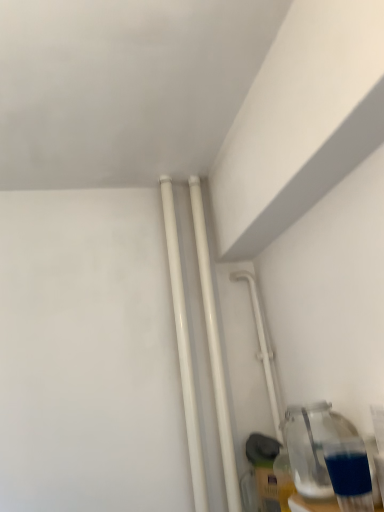
At what (x,y) coordinates should I click in order to perform the action: click on white glossy pipes at center, acting as the first pipe starting from the right. Please return your answer as a coordinate pair (x, y). Looking at the image, I should click on (214, 348).

What do you see at coordinates (214, 348) in the screenshot? I see `white glossy pipes at center, which is the 2th pipe in left-to-right order` at bounding box center [214, 348].

The height and width of the screenshot is (512, 384). I want to click on white glossy pipes at center, which is the second pipe from right to left, so coord(184,348).

The width and height of the screenshot is (384, 512). Describe the element at coordinates (310, 445) in the screenshot. I see `transparent glass bottle at lower right` at that location.

You are a GUI agent. You are given a task and a screenshot of the screen. Output one action in this format:
    pyautogui.click(x=<x>, y=<y>)
    Task: Click on the white glossy pipes at center, acting as the first pipe starting from the right
    
    Given the screenshot: What is the action you would take?
    pyautogui.click(x=214, y=348)

From a real-world perspective, which object stands above the other?

white glossy pipes at center, acting as the first pipe starting from the left, from a real-world perspective.

Is white glossy pipes at center, which is the second pipe from right to left, in contact with transparent glass bottle at lower right?

No.

Where is `bottle below the white glossy pipes at center, acting as the first pipe starting from the left (from a real-world perspective)`? Image resolution: width=384 pixels, height=512 pixels. bottle below the white glossy pipes at center, acting as the first pipe starting from the left (from a real-world perspective) is located at coordinates (310, 445).

Considering the positions of objects white glossy pipe at center-right and white glossy pipes at center, acting as the first pipe starting from the left, in the image provided, who is more to the right, white glossy pipe at center-right or white glossy pipes at center, acting as the first pipe starting from the left,?

white glossy pipe at center-right.

Based on the photo, from the image's perspective, is white glossy pipe at center-right over white glossy pipes at center, acting as the first pipe starting from the left?

Incorrect, from the image's perspective, white glossy pipe at center-right is lower than white glossy pipes at center, acting as the first pipe starting from the left.

How many degrees apart are the facing directions of white glossy pipe at center-right and white glossy pipes at center, acting as the first pipe starting from the left?

white glossy pipe at center-right and white glossy pipes at center, acting as the first pipe starting from the left, are facing 2.59 degrees away from each other.

Looking at the image, does white glossy pipe at center-right seem bigger or smaller compared to white glossy pipes at center, acting as the first pipe starting from the left?

white glossy pipe at center-right is bigger than white glossy pipes at center, acting as the first pipe starting from the left.

Considering the positions of points (303, 417) and (179, 253), is point (303, 417) closer to camera compared to point (179, 253)?

Yes, point (303, 417) is in front of point (179, 253).

Is transparent glass bottle at lower right positioned far away from white glossy pipes at center, acting as the first pipe starting from the left?

transparent glass bottle at lower right is actually quite close to white glossy pipes at center, acting as the first pipe starting from the left.

Is transparent glass bottle at lower right not inside white glossy pipes at center, which is the second pipe from right to left?

Yes, transparent glass bottle at lower right is outside of white glossy pipes at center, which is the second pipe from right to left.

From the image's perspective, starting from the transparent glass bottle at lower right, which pipe is the 2nd one above? Please provide its 2D coordinates.

[(184, 348)]

Looking at this image, is the position of transparent glass bottle at lower right less distant than that of white glossy pipe at center-right?

Yes, it is in front of white glossy pipe at center-right.

Does transparent glass bottle at lower right have a smaller size compared to white glossy pipe at center-right?

No.

In the scene shown: Between transparent glass bottle at lower right and white glossy pipe at center-right, which one has smaller width?

white glossy pipe at center-right.

Which is closer to the camera, (345, 430) or (275, 397)?

Point (345, 430) appears to be closer to the viewer than point (275, 397).

Who is smaller, white glossy pipes at center, acting as the first pipe starting from the right, or white glossy pipe at center-right?

Smaller between the two is white glossy pipes at center, acting as the first pipe starting from the right.

Which object is closer to the camera taking this photo, white glossy pipes at center, acting as the first pipe starting from the right, or white glossy pipe at center-right?

white glossy pipes at center, acting as the first pipe starting from the right, is more forward.

Between point (211, 308) and point (279, 416), which one is positioned behind?

The point (211, 308) is farther from the camera.

Can white glossy pipe at center-right be found inside white glossy pipes at center, which is the 2th pipe in left-to-right order?

Actually, white glossy pipe at center-right is outside white glossy pipes at center, which is the 2th pipe in left-to-right order.

Would you say transparent glass bottle at lower right is part of white glossy pipes at center, which is the 2th pipe in left-to-right order,'s contents?

No, transparent glass bottle at lower right is not inside white glossy pipes at center, which is the 2th pipe in left-to-right order.

In terms of width, does white glossy pipes at center, which is the 2th pipe in left-to-right order, look wider or thinner when compared to transparent glass bottle at lower right?

Considering their sizes, white glossy pipes at center, which is the 2th pipe in left-to-right order, looks slimmer than transparent glass bottle at lower right.

Which object is positioned more to the right, white glossy pipes at center, acting as the first pipe starting from the right, or transparent glass bottle at lower right?

Positioned to the right is transparent glass bottle at lower right.

From the image's perspective, which one is positioned higher, white glossy pipes at center, acting as the first pipe starting from the right, or transparent glass bottle at lower right?

white glossy pipes at center, acting as the first pipe starting from the right, appears higher in the image.

At what (x,y) coordinates should I click in order to perform the action: click on pipe that appears above the white glossy pipes at center, which is the 2th pipe in left-to-right order (from a real-world perspective). Please return your answer as a coordinate pair (x, y). This screenshot has height=512, width=384. Looking at the image, I should click on (184, 348).

Visually, is white glossy pipes at center, acting as the first pipe starting from the left, positioned to the left or to the right of white glossy pipes at center, which is the 2th pipe in left-to-right order?

Clearly, white glossy pipes at center, acting as the first pipe starting from the left, is on the left of white glossy pipes at center, which is the 2th pipe in left-to-right order, in the image.

Consider the image. Can you see white glossy pipes at center, which is the second pipe from right to left, touching white glossy pipes at center, acting as the first pipe starting from the right?

Yes, white glossy pipes at center, which is the second pipe from right to left, is in contact with white glossy pipes at center, acting as the first pipe starting from the right.

Which is less distant, (187, 375) or (229, 458)?

The point (229, 458) is closer to the camera.

I want to click on the 2nd pipe to the left of the transparent glass bottle at lower right, counting from the anchor's position, so click(184, 348).

You are a GUI agent. You are given a task and a screenshot of the screen. Output one action in this format:
    pyautogui.click(x=<x>, y=<y>)
    Task: Click on the 2nd pipe above when counting from the white glossy pipe at center-right (from the image's perspective)
    This screenshot has height=512, width=384.
    Given the screenshot: What is the action you would take?
    pyautogui.click(x=184, y=348)

Looking at the image, which one is located further to white glossy pipes at center, which is the second pipe from right to left, transparent glass bottle at lower right or white glossy pipes at center, acting as the first pipe starting from the right?

transparent glass bottle at lower right is further to white glossy pipes at center, which is the second pipe from right to left.

From the picture: Considering their positions, is white glossy pipes at center, acting as the first pipe starting from the right, positioned closer to white glossy pipes at center, acting as the first pipe starting from the left, than white glossy pipe at center-right?

white glossy pipes at center, acting as the first pipe starting from the right.

Looking at the image, which one is located closer to white glossy pipe at center-right, white glossy pipes at center, which is the 2th pipe in left-to-right order, or transparent glass bottle at lower right?

white glossy pipes at center, which is the 2th pipe in left-to-right order, is positioned closer to the anchor white glossy pipe at center-right.

In the scene shown: Estimate the real-world distances between objects in this image. Which object is further from transparent glass bottle at lower right, white glossy pipe at center-right or white glossy pipes at center, acting as the first pipe starting from the right?

Among the two, white glossy pipes at center, acting as the first pipe starting from the right, is located further to transparent glass bottle at lower right.

Estimate the real-world distances between objects in this image. Which object is closer to white glossy pipes at center, which is the 2th pipe in left-to-right order, transparent glass bottle at lower right or white glossy pipe at center-right?

white glossy pipe at center-right.

Based on their spatial positions, is white glossy pipes at center, acting as the first pipe starting from the left, or white glossy pipes at center, acting as the first pipe starting from the right, closer to transparent glass bottle at lower right?

Among the two, white glossy pipes at center, acting as the first pipe starting from the right, is located nearer to transparent glass bottle at lower right.

Considering their positions, is white glossy pipe at center-right positioned further to white glossy pipes at center, acting as the first pipe starting from the left, than transparent glass bottle at lower right?

Based on the image, transparent glass bottle at lower right appears to be further to white glossy pipes at center, acting as the first pipe starting from the left.

Estimate the real-world distances between objects in this image. Which object is further from transparent glass bottle at lower right, white glossy pipes at center, which is the 2th pipe in left-to-right order, or white glossy pipe at center-right?

white glossy pipes at center, which is the 2th pipe in left-to-right order, lies further to transparent glass bottle at lower right than the other object.

This screenshot has width=384, height=512. I want to click on pipe located between transparent glass bottle at lower right and white glossy pipes at center, acting as the first pipe starting from the right, in the depth direction, so click(184, 348).

At what (x,y) coordinates should I click in order to perform the action: click on pipe between white glossy pipes at center, which is the second pipe from right to left, and white glossy pipe at center-right, in the horizontal direction. Please return your answer as a coordinate pair (x, y). Looking at the image, I should click on (214, 348).